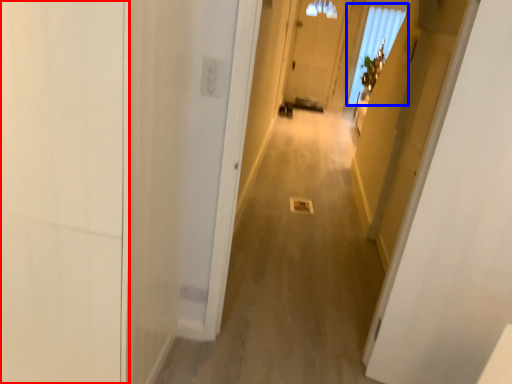
Question: Which point is closer to the camera, door (highlighted by a red box) or window (highlighted by a blue box)?

Choices:
 (A) door
 (B) window

Answer: (A)